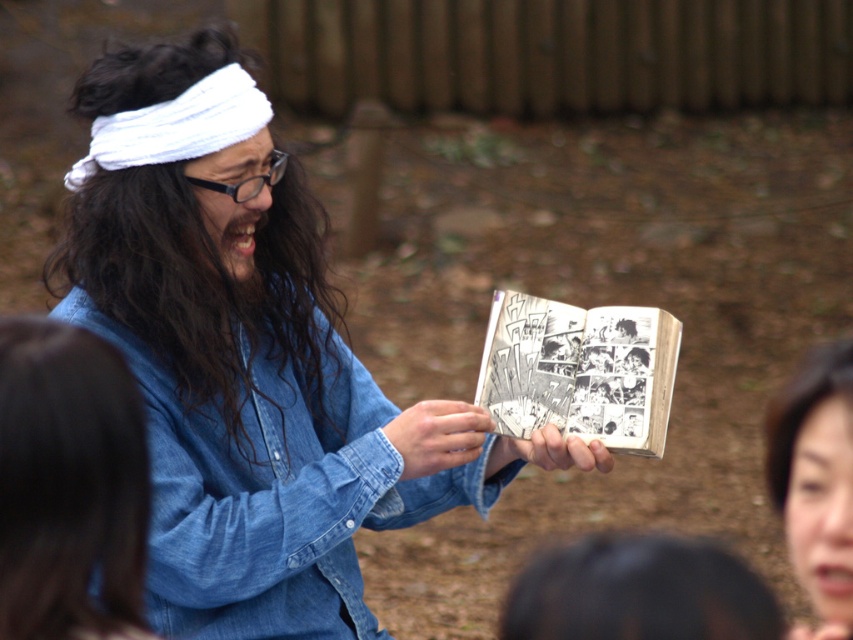
Question: Among these objects, which one is nearest to the camera?

Choices:
 (A) smooth brown hair at lower right
 (B) denim jacket at center
 (C) black paper comic book at center

Answer: (B)

Question: Does denim jacket at center lie behind smooth brown hair at lower right?

Choices:
 (A) yes
 (B) no

Answer: (B)

Question: Based on their relative distances, which object is farther from the denim jacket at center?

Choices:
 (A) smooth brown hair at lower right
 (B) dark brown wavy hair at center

Answer: (A)

Question: Which of the following is the farthest from the observer?

Choices:
 (A) (351, 513)
 (B) (596, 333)
 (C) (80, 86)
 (D) (804, 454)

Answer: (C)

Question: Does dark brown wavy hair at center have a smaller size compared to smooth brown hair at lower right?

Choices:
 (A) yes
 (B) no

Answer: (B)

Question: Is black paper comic book at center bigger than smooth brown hair at lower right?

Choices:
 (A) no
 (B) yes

Answer: (B)